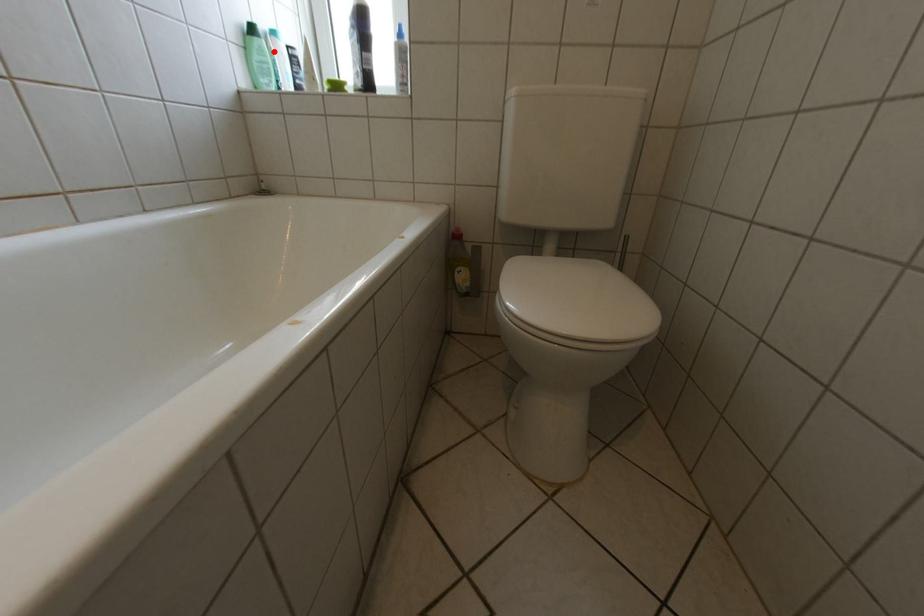
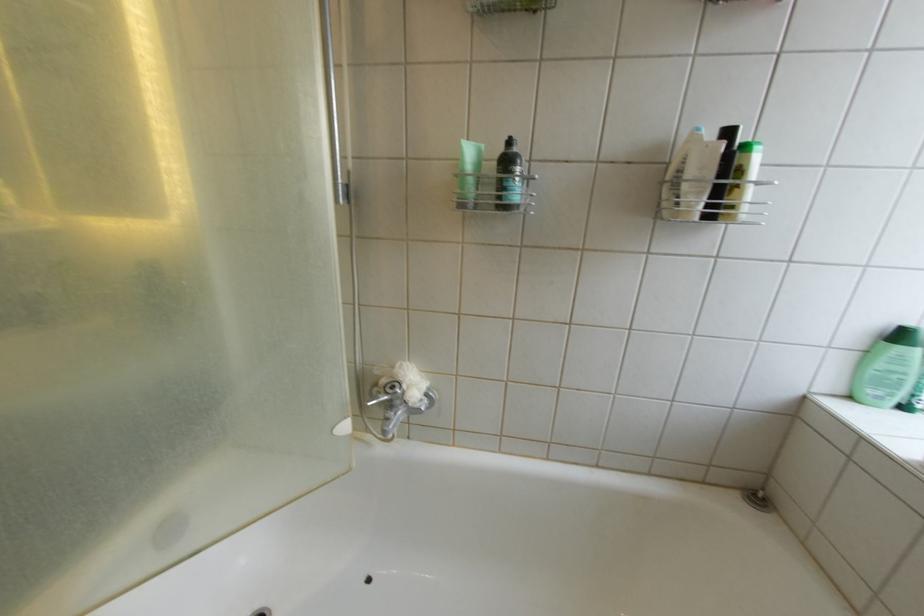
Find the pixel in the second image that matches the highlighted location in the first image.

(914, 361)